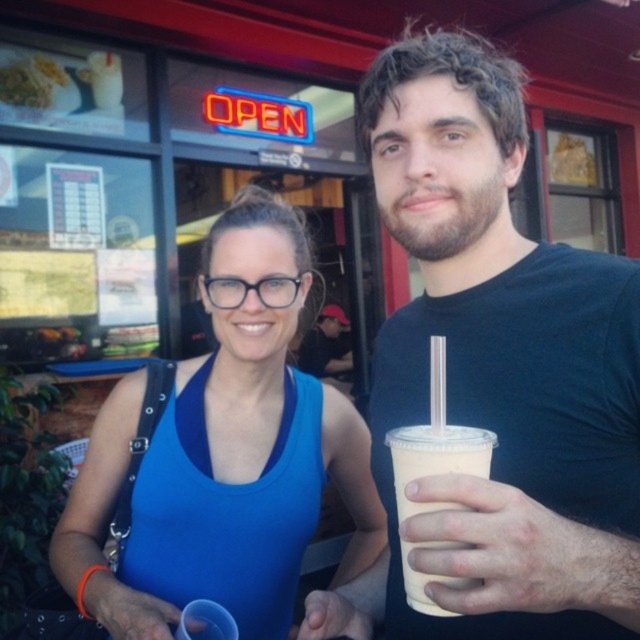
Can you confirm if black matte cup at center is thinner than ivory matte cup at right?

No.

Who is lower down, black matte cup at center or ivory matte cup at right?

ivory matte cup at right

The image size is (640, 640). In order to click on black matte cup at center in this screenshot , I will do `click(496, 371)`.

Which is above, black matte cup at center or white glossy plate at upper left?

white glossy plate at upper left

The image size is (640, 640). I want to click on black matte cup at center, so click(x=496, y=371).

Who is more distant from viewer, (212, 401) or (52, 81)?

The point (52, 81) is more distant.

Between point (358, 438) and point (36, 92), which one is positioned in front?

Point (358, 438) is more forward.

Who is more forward, (288,376) or (35,96)?

Point (288,376)

Where is `blue fabric tank top at center`? The height and width of the screenshot is (640, 640). blue fabric tank top at center is located at coordinates (225, 456).